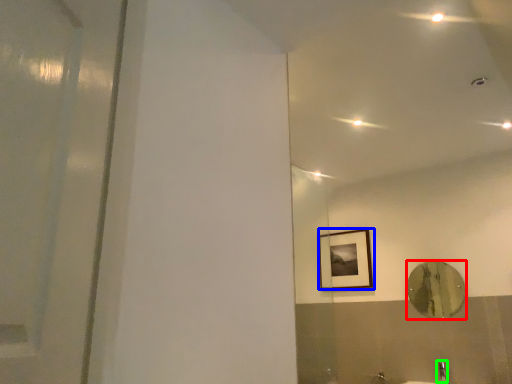
Question: Which object is positioned closest to mirror (highlighted by a red box)? Select from picture frame (highlighted by a blue box) and faucet (highlighted by a green box).

Choices:
 (A) picture frame
 (B) faucet

Answer: (B)